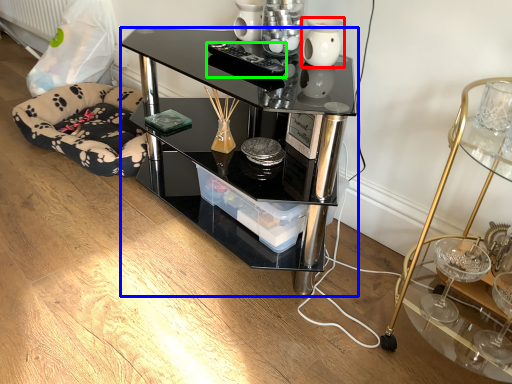
Question: Based on their relative distances, which object is farther from vase (highlighted by a red box)? Choose from desk (highlighted by a blue box) and remote control (highlighted by a green box).

Choices:
 (A) desk
 (B) remote control

Answer: (A)